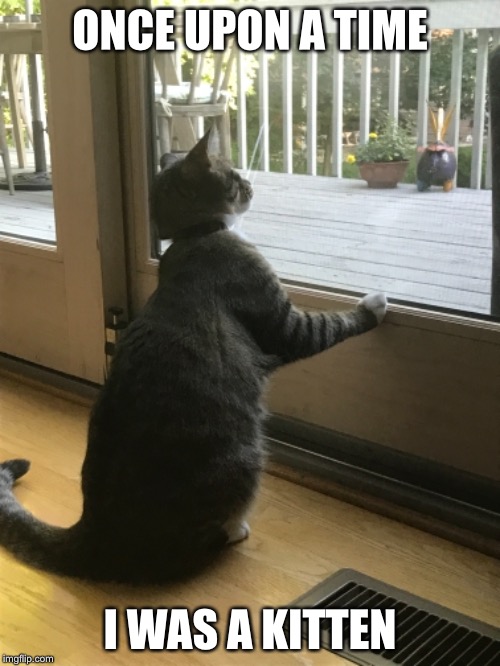
I want to click on pots, so click(393, 170), click(433, 168).